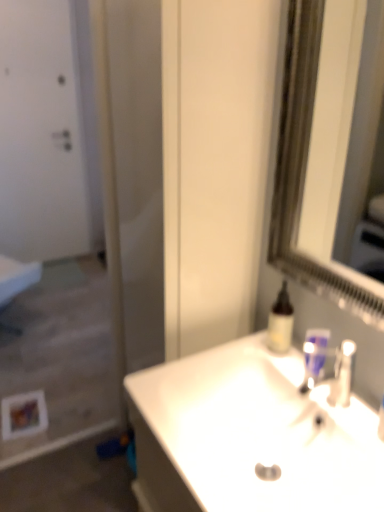
Question: From the image's perspective, is translucent plastic bottle at upper right, which is the first mouthwash in left-to-right order, on white glossy sink at center?

Choices:
 (A) yes
 (B) no

Answer: (A)

Question: Would you consider translucent plastic bottle at upper right, acting as the 2th mouthwash starting from the right, to be distant from white glossy sink at center?

Choices:
 (A) no
 (B) yes

Answer: (A)

Question: Is translucent plastic bottle at upper right, which is the first mouthwash in left-to-right order, positioned before white glossy sink at center?

Choices:
 (A) yes
 (B) no

Answer: (B)

Question: Does translucent plastic bottle at upper right, which is the first mouthwash in left-to-right order, turn towards white glossy sink at center?

Choices:
 (A) no
 (B) yes

Answer: (B)

Question: Does translucent plastic bottle at upper right, acting as the 2th mouthwash starting from the right, contain white glossy sink at center?

Choices:
 (A) no
 (B) yes

Answer: (A)

Question: Based on their sizes in the image, would you say white matte door at upper left is bigger or smaller than silver metallic mirror at upper right?

Choices:
 (A) big
 (B) small

Answer: (A)

Question: Considering their positions, is white matte door at upper left located in front of or behind silver metallic mirror at upper right?

Choices:
 (A) behind
 (B) front

Answer: (A)

Question: Considering the positions of white matte door at upper left and silver metallic mirror at upper right in the image, is white matte door at upper left wider or thinner than silver metallic mirror at upper right?

Choices:
 (A) wide
 (B) thin

Answer: (A)

Question: From the image's perspective, relative to silver metallic mirror at upper right, is white matte door at upper left above or below?

Choices:
 (A) below
 (B) above

Answer: (B)

Question: Based on their sizes in the image, would you say blue plastic mouthwash at sink, the first mouthwash viewed from the right, is bigger or smaller than white glossy sink at center?

Choices:
 (A) small
 (B) big

Answer: (A)

Question: Is blue plastic mouthwash at sink, the first mouthwash viewed from the right, wider or thinner than white glossy sink at center?

Choices:
 (A) wide
 (B) thin

Answer: (B)

Question: From a real-world perspective, is blue plastic mouthwash at sink, the first mouthwash viewed from the right, above or below white glossy sink at center?

Choices:
 (A) below
 (B) above

Answer: (B)

Question: Based on their positions, is blue plastic mouthwash at sink, the first mouthwash viewed from the right, located to the left or right of white glossy sink at center?

Choices:
 (A) right
 (B) left

Answer: (A)

Question: From a real-world perspective, is blue plastic mouthwash at sink, the first mouthwash viewed from the right, positioned above or below translucent plastic bottle at upper right, which is the first mouthwash in left-to-right order?

Choices:
 (A) below
 (B) above

Answer: (A)

Question: From the image's perspective, is blue plastic mouthwash at sink, the first mouthwash viewed from the right, positioned above or below translucent plastic bottle at upper right, which is the first mouthwash in left-to-right order?

Choices:
 (A) below
 (B) above

Answer: (A)